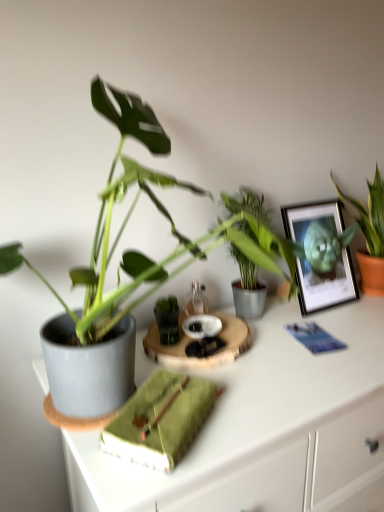
The image size is (384, 512). I want to click on free location to the right of green fabric book at center, so click(x=251, y=414).